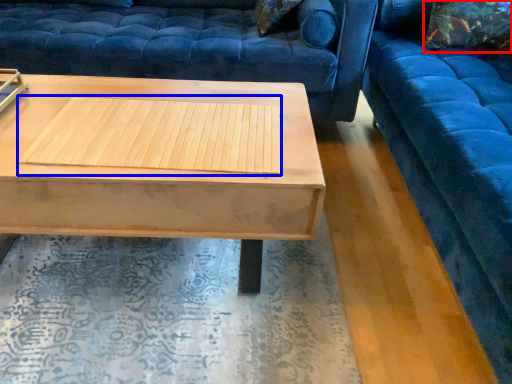
Question: Which object is further to the camera taking this photo, pillow (highlighted by a red box) or wood (highlighted by a blue box)?

Choices:
 (A) pillow
 (B) wood

Answer: (A)